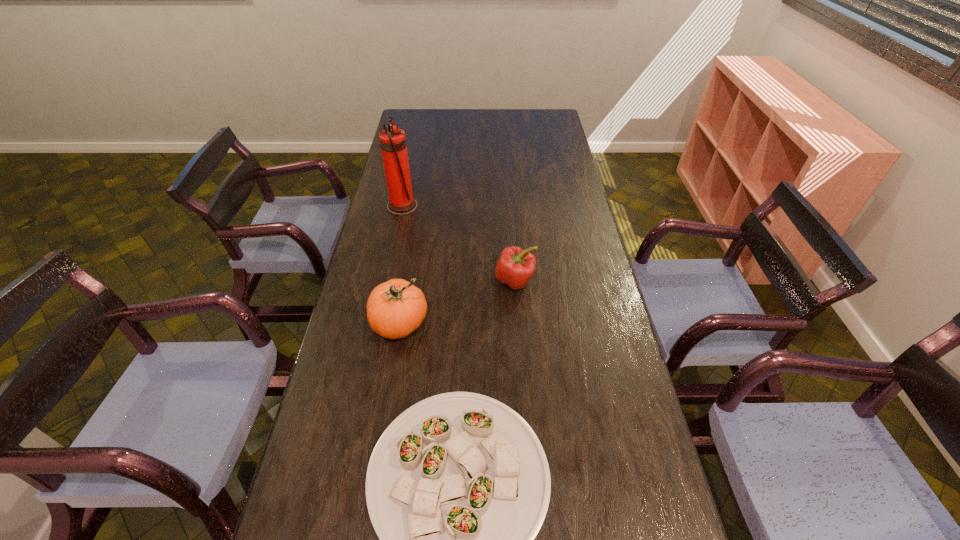
Find the location of `the tallest object`. the tallest object is located at coordinates [392, 139].

Image resolution: width=960 pixels, height=540 pixels. I want to click on fire extinguisher, so click(392, 139).

Locate an element on the screen. The image size is (960, 540). the second tallest object is located at coordinates (395, 308).

The image size is (960, 540). What are the coordinates of `the second nearest object` in the screenshot? It's located at (395, 308).

The image size is (960, 540). In order to click on the second shortest object in this screenshot , I will do `click(515, 266)`.

Locate an element on the screen. bell pepper is located at coordinates (515, 266).

Find the location of a particular element. The image size is (960, 540). vacant space located 0.350m at the discharge end of the farthest object is located at coordinates (506, 206).

Locate an element on the screen. Image resolution: width=960 pixels, height=540 pixels. vacant space located on the right of the third farthest object is located at coordinates (462, 323).

At what (x,y) coordinates should I click in order to perform the action: click on free space located 0.210m on the front of the third tallest object. Please return your answer as a coordinate pair (x, y). This screenshot has height=540, width=960. Looking at the image, I should click on (520, 350).

This screenshot has width=960, height=540. Identify the location of fire extinguisher present at the left edge. (392, 139).